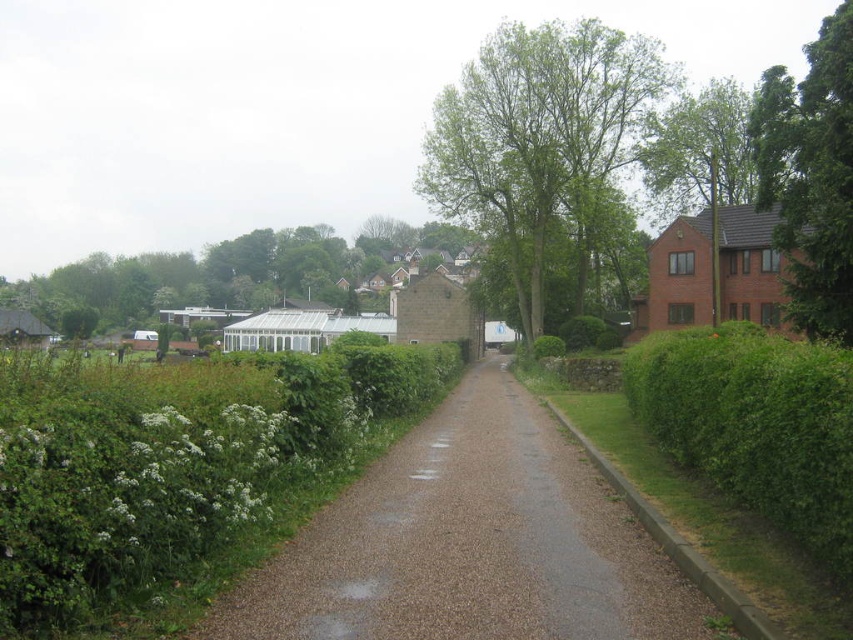
You are standing at the entrance of the greenhouse with a glass roof on the left side of the image. You need to reach the brown gravel driveway at center to park your car. Which direction should you head towards from your current position?

Since the brown gravel driveway at center is located at point (469, 541), you should head towards the center of the image from the greenhouse on the left to reach it.

Looking at this image, you are a delivery driver with a truck that is 8 feet wide. You need to drive along the brown gravel driveway at center. Can your truck fit on the driveway?

The brown gravel driveway at center is 17.34 feet from camera. Since the truck is 8 feet wide, it should fit as long as the driveway is wide enough. However, the provided information only mentions the distance from the camera, not the width of the driveway itself. Therefore, we cannot determine if the truck will fit based on the given data.